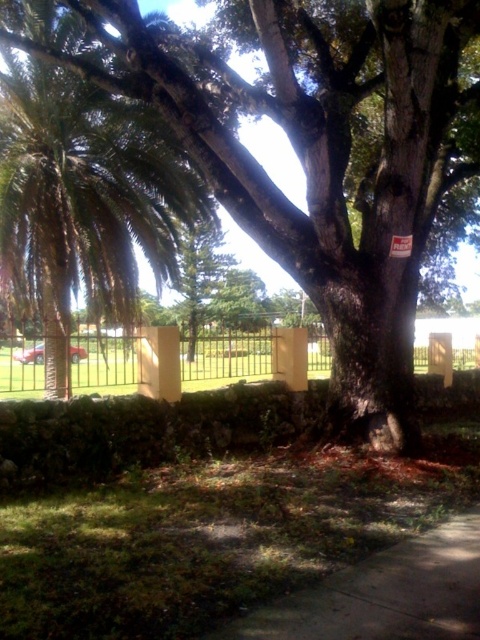
You are standing at the origin point of the coordinate system in the image. The green rough bark tree at center is located at point 0.244, 0.656. If you want to walk directly towards the tree, which direction should you move in terms of the coordinate system?

To walk directly towards the green rough bark tree at center located at coordinates (314, 156) from the origin, you should move in the positive x and positive y direction since the tree is in the positive quadrant relative to the origin.

You are standing in front of the green rough bark tree at center and want to reach the metallic silver fence at center. Based on their sizes, which object would you need to navigate around more carefully?

The metallic silver fence at center occupies more space than the green rough bark tree at center, so you would need to navigate around it more carefully due to its larger size.